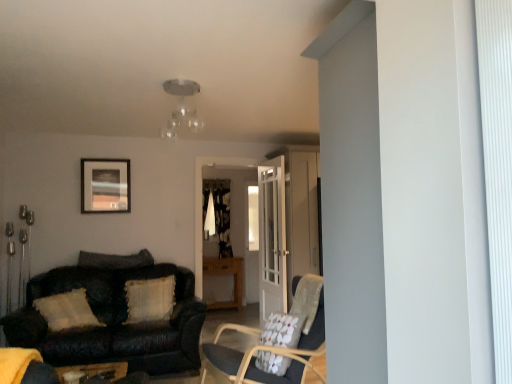
Question: Is floral fabric chair at center to the left of textured beige pillow at center left, which ranks as the 2th pillow in back-to-front order, from the viewer's perspective?

Choices:
 (A) yes
 (B) no

Answer: (B)

Question: Is floral fabric chair at center located outside textured beige pillow at center left, which is the 2th pillow from left to right?

Choices:
 (A) yes
 (B) no

Answer: (A)

Question: Is floral fabric chair at center with textured beige pillow at center left, which is counted as the 2th pillow, starting from the right?

Choices:
 (A) yes
 (B) no

Answer: (B)

Question: Considering the relative sizes of floral fabric chair at center and textured beige pillow at center left, which ranks as the 2th pillow in back-to-front order, in the image provided, is floral fabric chair at center thinner than textured beige pillow at center left, which ranks as the 2th pillow in back-to-front order,?

Choices:
 (A) yes
 (B) no

Answer: (B)

Question: Is floral fabric chair at center oriented away from textured beige pillow at center left, which is the 2th pillow from left to right?

Choices:
 (A) no
 (B) yes

Answer: (A)

Question: Visually, is white glass door at center positioned to the left or to the right of wooden table at center?

Choices:
 (A) left
 (B) right

Answer: (B)

Question: In terms of height, does white glass door at center look taller or shorter compared to wooden table at center?

Choices:
 (A) tall
 (B) short

Answer: (A)

Question: In the image, is white glass door at center positioned in front of or behind wooden table at center?

Choices:
 (A) front
 (B) behind

Answer: (A)

Question: Considering the positions of white glass door at center and wooden table at center in the image, is white glass door at center wider or thinner than wooden table at center?

Choices:
 (A) wide
 (B) thin

Answer: (B)

Question: Considering the positions of point (160, 264) and point (129, 296), is point (160, 264) closer or farther from the camera than point (129, 296)?

Choices:
 (A) closer
 (B) farther

Answer: (B)

Question: Is leather couch at left bigger or smaller than textured beige pillow at center left, the second pillow positioned from the front?

Choices:
 (A) small
 (B) big

Answer: (B)

Question: From the image's perspective, is leather couch at left positioned above or below textured beige pillow at center left, which is the 2th pillow from left to right?

Choices:
 (A) below
 (B) above

Answer: (A)

Question: Would you say leather couch at left is inside or outside textured beige pillow at center left, which is the 2th pillow from left to right?

Choices:
 (A) outside
 (B) inside

Answer: (A)

Question: Considering the positions of clear glass light fixture at upper center and matte black picture frame at upper left in the image, is clear glass light fixture at upper center wider or thinner than matte black picture frame at upper left?

Choices:
 (A) thin
 (B) wide

Answer: (B)

Question: Which is correct: clear glass light fixture at upper center is inside matte black picture frame at upper left, or outside of it?

Choices:
 (A) outside
 (B) inside

Answer: (A)